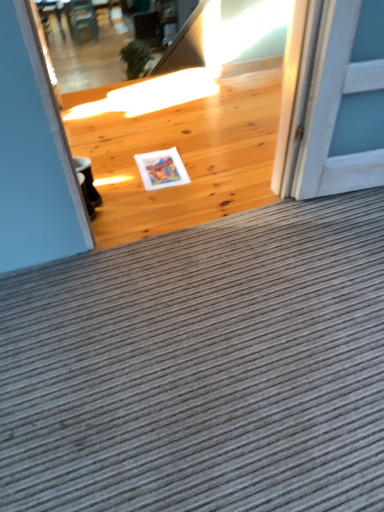
Question: Should I look upward or downward to see white matte postcard at center?

Choices:
 (A) down
 (B) up

Answer: (B)

Question: Can you confirm if gray corduroy doormat at center is taller than white matte postcard at center?

Choices:
 (A) no
 (B) yes

Answer: (B)

Question: Is gray corduroy doormat at center oriented towards white matte postcard at center?

Choices:
 (A) yes
 (B) no

Answer: (A)

Question: From the image's perspective, is gray corduroy doormat at center on white matte postcard at center?

Choices:
 (A) no
 (B) yes

Answer: (A)

Question: From the image's perspective, does gray corduroy doormat at center appear lower than white matte postcard at center?

Choices:
 (A) no
 (B) yes

Answer: (B)

Question: Is gray corduroy doormat at center oriented away from white matte postcard at center?

Choices:
 (A) no
 (B) yes

Answer: (A)

Question: Does gray corduroy doormat at center appear on the right side of white matte postcard at center?

Choices:
 (A) no
 (B) yes

Answer: (B)

Question: Can you confirm if gray corduroy doormat at center is taller than wooden chair at upper left?

Choices:
 (A) no
 (B) yes

Answer: (A)

Question: Is gray corduroy doormat at center completely or partially outside of wooden chair at upper left?

Choices:
 (A) yes
 (B) no

Answer: (A)

Question: From a real-world perspective, does gray corduroy doormat at center stand above wooden chair at upper left?

Choices:
 (A) yes
 (B) no

Answer: (A)

Question: Does gray corduroy doormat at center have a lesser width compared to wooden chair at upper left?

Choices:
 (A) yes
 (B) no

Answer: (B)

Question: Does gray corduroy doormat at center have a larger size compared to wooden chair at upper left?

Choices:
 (A) no
 (B) yes

Answer: (A)

Question: Can you confirm if gray corduroy doormat at center is smaller than wooden chair at upper left?

Choices:
 (A) no
 (B) yes

Answer: (B)

Question: Can you see white matte postcard at center touching gray corduroy doormat at center?

Choices:
 (A) yes
 (B) no

Answer: (B)